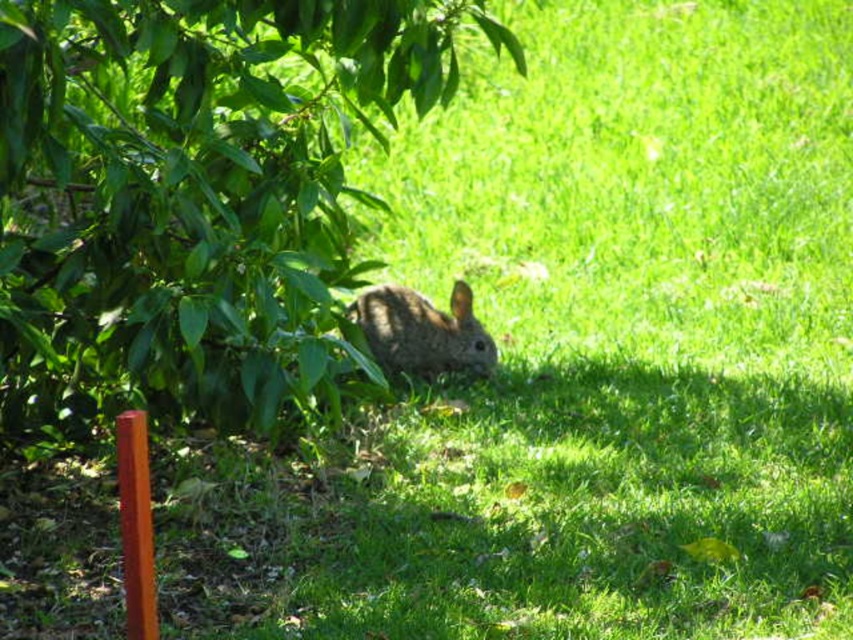
Is green leafy tree at center behind fuzzy brown rabbit at center?

No.

Does point (252, 40) come behind point (402, 298)?

No.

What are the coordinates of `green leafy tree at center` in the screenshot? It's located at (193, 198).